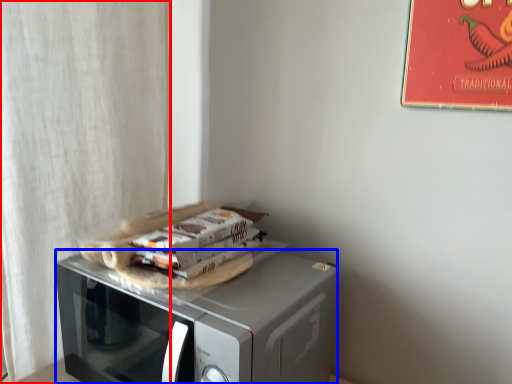
Question: Among these objects, which one is farthest to the camera, curtain (highlighted by a red box) or microwave oven (highlighted by a blue box)?

Choices:
 (A) curtain
 (B) microwave oven

Answer: (A)